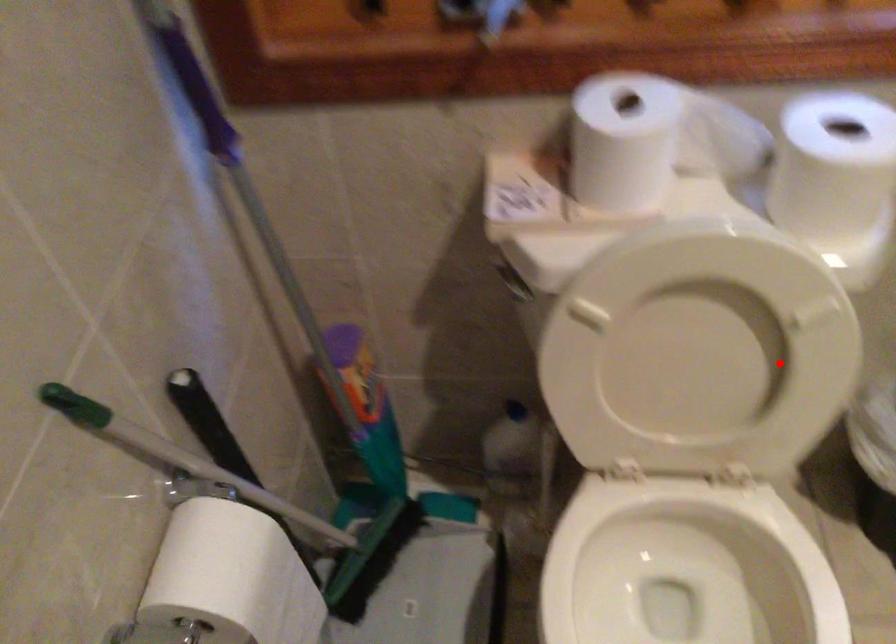
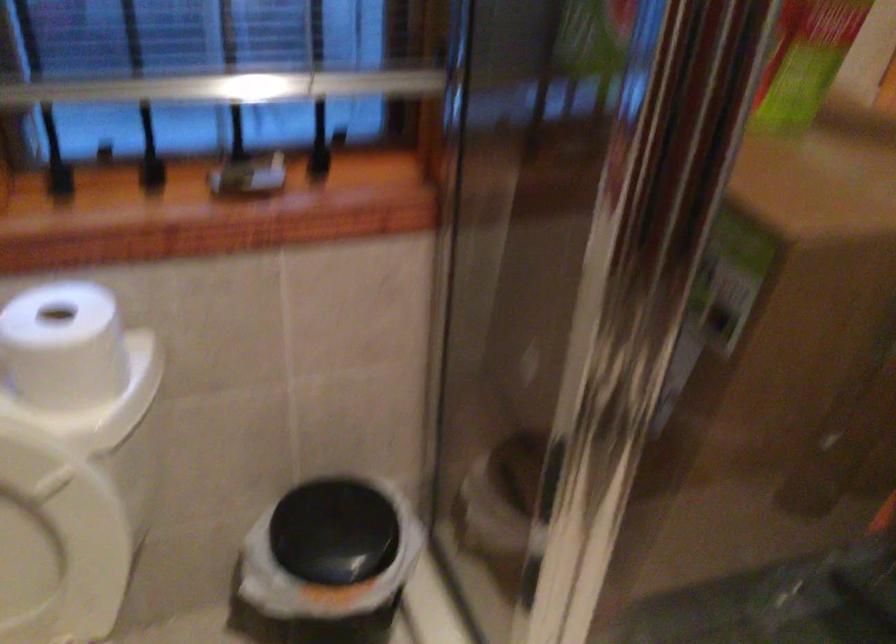
Where in the second image is the point corresponding to the highlighted location from the first image?

(56, 541)